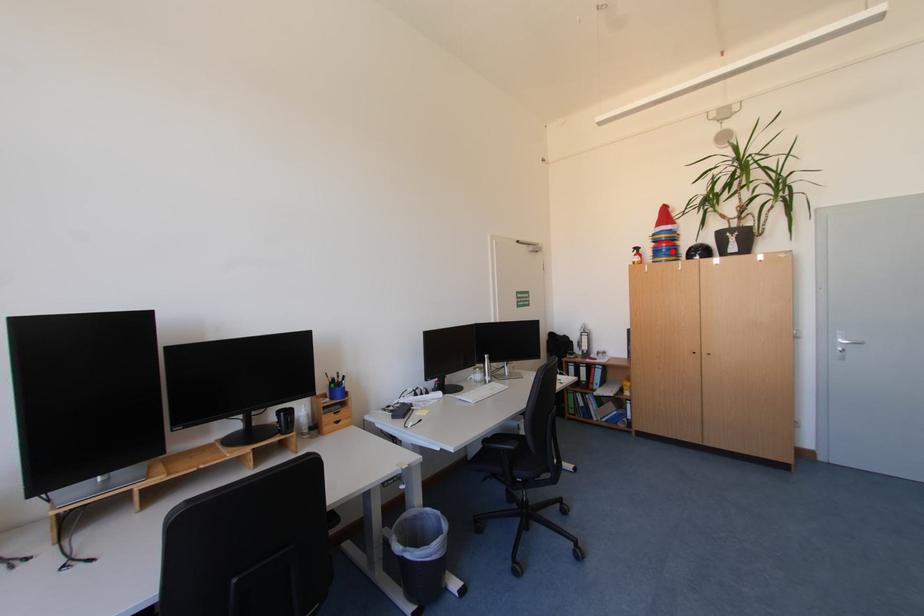
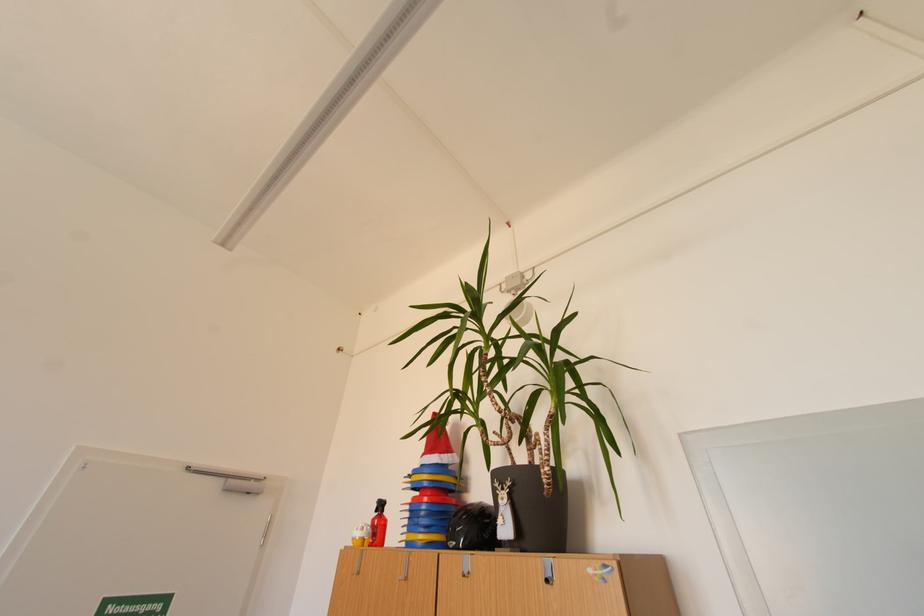
Question: I am providing you with two images of the same scene from different viewpoints. Given a red point in image1, look at the same physical point in image2. Is it:

Choices:
 (A) Closer to the viewpoint
 (B) Farther from the viewpoint

Answer: (B)